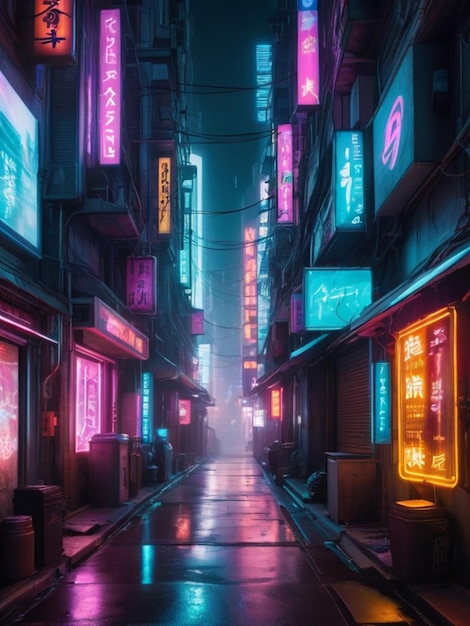
At what (x,y) coordinates should I click in order to perform the action: click on neon lights on sign. Please return your answer as a coordinate pair (x, y). The width and height of the screenshot is (470, 626). Looking at the image, I should click on (412, 387), (91, 404), (276, 409).